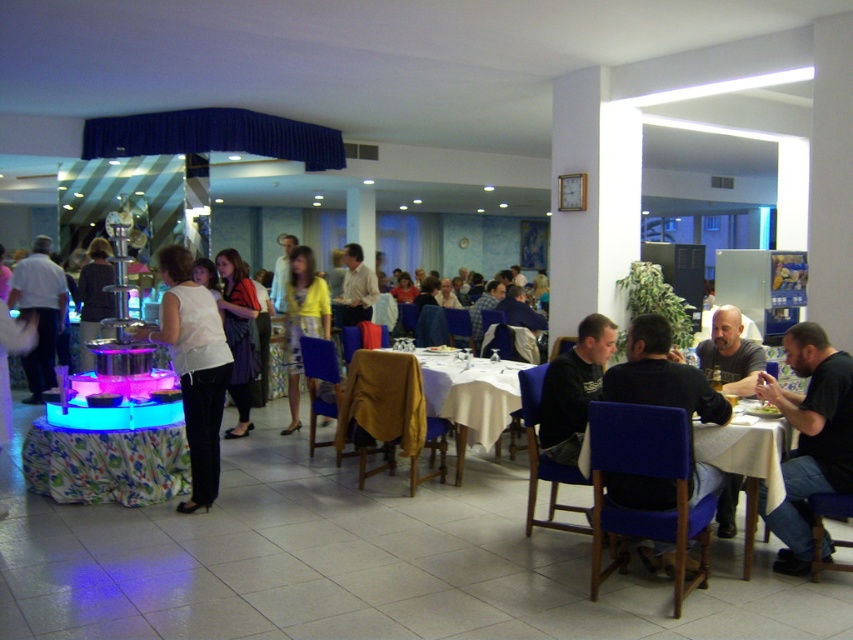
Is point (155, 426) farther from camera compared to point (625, 394)?

Yes, it is behind point (625, 394).

Is point (53, 435) closer to viewer compared to point (694, 406)?

No.

I want to click on floral fabric table at center, so click(108, 454).

Is white fabric table at center further to the viewer compared to white fabric table at lower right?

Yes.

Is white fabric table at center above white fabric table at lower right?

Correct, white fabric table at center is located above white fabric table at lower right.

Is point (457, 436) positioned behind point (772, 481)?

That is True.

Where is `white fabric table at center`? white fabric table at center is located at coordinates (460, 400).

Is white fabric dress at center wider than black matte shirt at lower right?

Yes, white fabric dress at center is wider than black matte shirt at lower right.

Which is behind, point (189, 364) or point (570, 436)?

The point (189, 364) is more distant.

Locate an element on the screen. The height and width of the screenshot is (640, 853). white fabric dress at center is located at coordinates (194, 368).

Find the location of a particular element. white fabric dress at center is located at coordinates (194, 368).